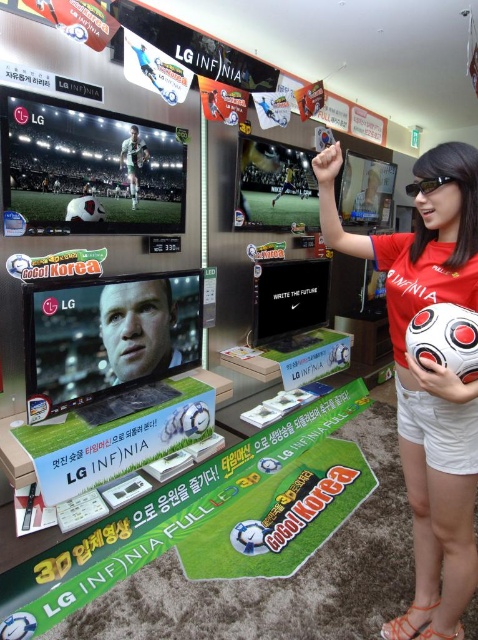
Question: Does matte red shirt at center come behind shiny plastic soccer ball at upper left?

Choices:
 (A) yes
 (B) no

Answer: (B)

Question: Can you confirm if matte red shirt at center is positioned to the left of shiny plastic soccer ball at upper left?

Choices:
 (A) no
 (B) yes

Answer: (A)

Question: Among these points, which one is nearest to the camera?

Choices:
 (A) (156, 168)
 (B) (434, 196)

Answer: (B)

Question: Which object appears closest to the camera in this image?

Choices:
 (A) shiny plastic soccer ball at upper left
 (B) matte red shirt at center

Answer: (B)

Question: Observing the image, what is the correct spatial positioning of matte red shirt at center in reference to shiny plastic soccer ball at upper left?

Choices:
 (A) above
 (B) below

Answer: (B)